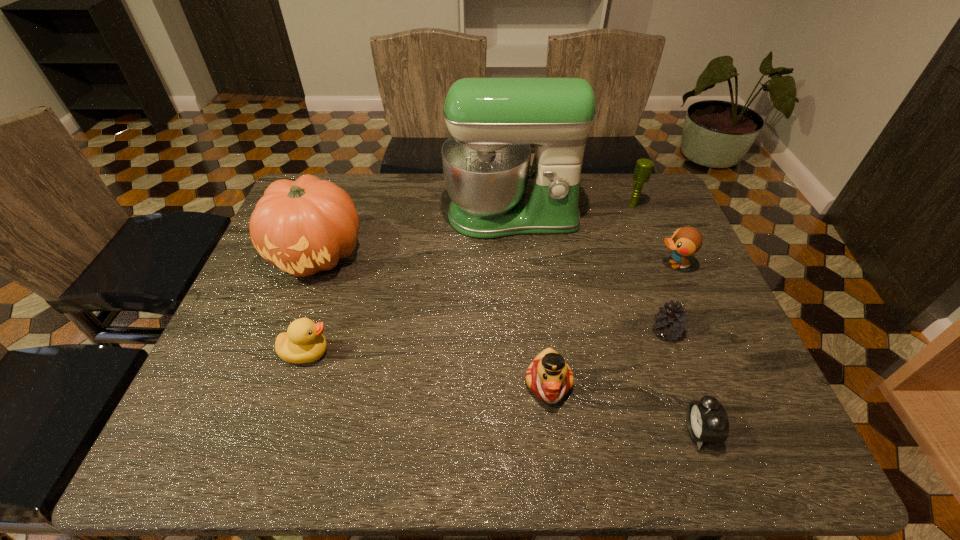
Image resolution: width=960 pixels, height=540 pixels. In order to click on mixer in this screenshot , I will do `click(493, 121)`.

The width and height of the screenshot is (960, 540). In order to click on pumpkin in this screenshot , I will do `click(305, 226)`.

Find the location of a particular element. This screenshot has width=960, height=540. microphone is located at coordinates (643, 169).

Image resolution: width=960 pixels, height=540 pixels. I want to click on the farthest duck, so click(686, 241).

Find the location of `the second duck from left to right`. the second duck from left to right is located at coordinates (549, 377).

You are a GUI agent. You are given a task and a screenshot of the screen. Output one action in this format:
    pyautogui.click(x=<x>, y=<y>)
    Task: Click on the leftmost duck
    This screenshot has width=960, height=540.
    Given the screenshot: What is the action you would take?
    pyautogui.click(x=303, y=342)

This screenshot has height=540, width=960. I want to click on pinecone, so coord(670,322).

You are a GUI agent. You are given a task and a screenshot of the screen. Output one action in this format:
    pyautogui.click(x=<x>, y=<y>)
    Task: Click on the nearest object
    Image resolution: width=960 pixels, height=540 pixels.
    Given the screenshot: What is the action you would take?
    pyautogui.click(x=707, y=421)

The image size is (960, 540). Identify the location of free space located on the controls of the mixer. (522, 348).

Find the location of `vacant space located 0.370m on the carved face of the second tallest object`. vacant space located 0.370m on the carved face of the second tallest object is located at coordinates (253, 426).